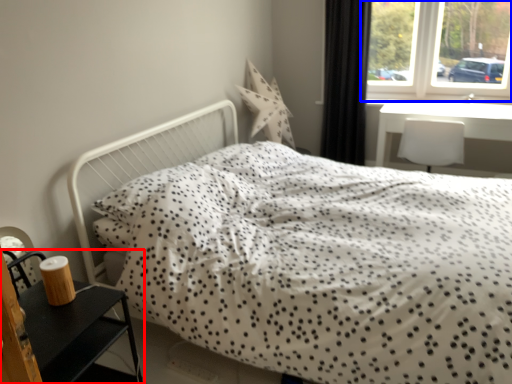
Question: Which object is further to the camera taking this photo, nightstand (highlighted by a red box) or window (highlighted by a blue box)?

Choices:
 (A) nightstand
 (B) window

Answer: (B)